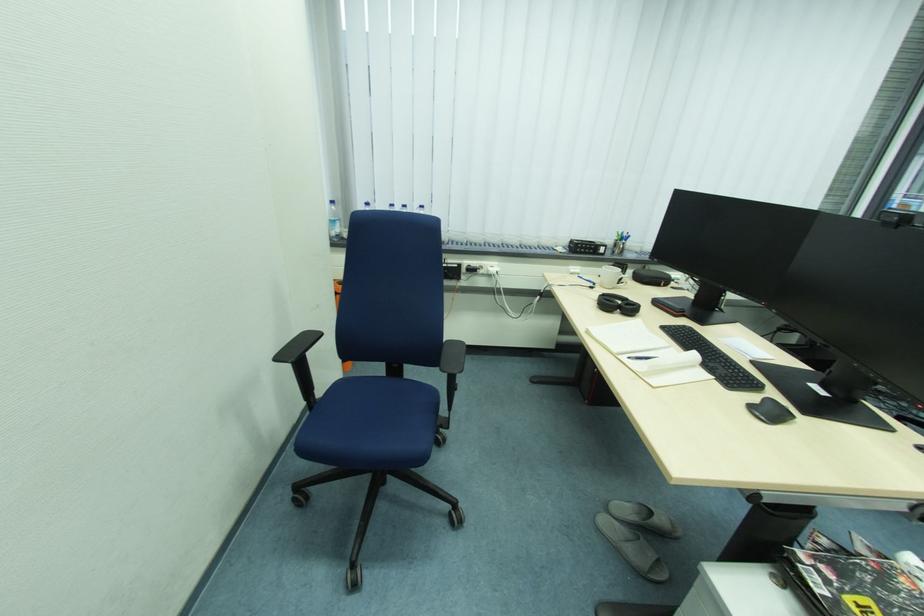
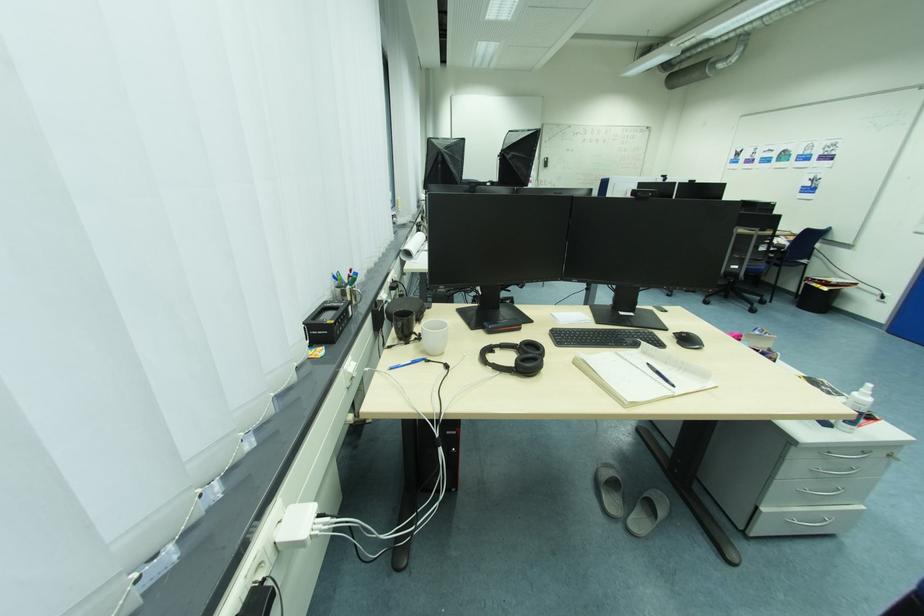
Find the pixel in the second image that matches pixel 636 359 in the first image.

(681, 387)